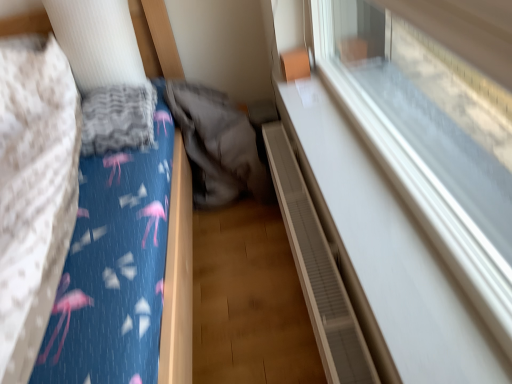
Question: Does transparent glass window at upper right contain gray fabric sleeping bag at center?

Choices:
 (A) no
 (B) yes

Answer: (A)

Question: From a real-world perspective, is transparent glass window at upper right under gray fabric sleeping bag at center?

Choices:
 (A) no
 (B) yes

Answer: (A)

Question: Is transparent glass window at upper right in contact with gray fabric sleeping bag at center?

Choices:
 (A) no
 (B) yes

Answer: (A)

Question: Is transparent glass window at upper right turned away from gray fabric sleeping bag at center?

Choices:
 (A) yes
 (B) no

Answer: (B)

Question: Does transparent glass window at upper right have a larger size compared to gray fabric sleeping bag at center?

Choices:
 (A) yes
 (B) no

Answer: (B)

Question: Considering the positions of blue fabric bed at left and brown textured radiator at lower right in the image, is blue fabric bed at left taller or shorter than brown textured radiator at lower right?

Choices:
 (A) short
 (B) tall

Answer: (B)

Question: In the image, is blue fabric bed at left positioned in front of or behind brown textured radiator at lower right?

Choices:
 (A) front
 (B) behind

Answer: (A)

Question: Visually, is blue fabric bed at left positioned to the left or to the right of brown textured radiator at lower right?

Choices:
 (A) left
 (B) right

Answer: (A)

Question: Which is correct: blue fabric bed at left is inside brown textured radiator at lower right, or outside of it?

Choices:
 (A) outside
 (B) inside

Answer: (A)

Question: Would you say gray fabric sleeping bag at center is to the left or to the right of blue cotton sheet at left in the picture?

Choices:
 (A) right
 (B) left

Answer: (A)

Question: Considering the positions of gray fabric sleeping bag at center and blue cotton sheet at left in the image, is gray fabric sleeping bag at center taller or shorter than blue cotton sheet at left?

Choices:
 (A) short
 (B) tall

Answer: (B)

Question: Does point (220, 135) appear closer or farther from the camera than point (42, 76)?

Choices:
 (A) closer
 (B) farther

Answer: (B)

Question: Considering the positions of gray fabric sleeping bag at center and blue cotton sheet at left in the image, is gray fabric sleeping bag at center wider or thinner than blue cotton sheet at left?

Choices:
 (A) wide
 (B) thin

Answer: (B)

Question: Do you think transparent glass window at upper right is within blue fabric bed at left, or outside of it?

Choices:
 (A) outside
 (B) inside

Answer: (A)

Question: Considering the positions of point (367, 19) and point (166, 296), is point (367, 19) closer or farther from the camera than point (166, 296)?

Choices:
 (A) closer
 (B) farther

Answer: (B)